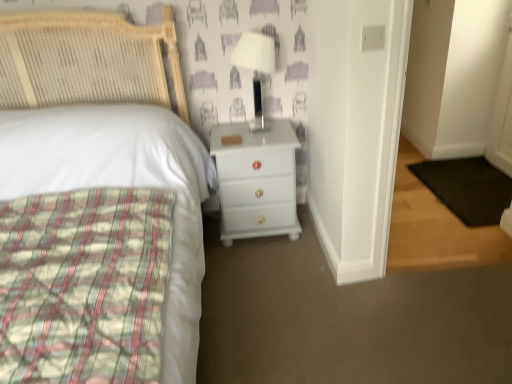
Question: Is white glossy lamp at upper right aimed at white glossy chest of drawers at center?

Choices:
 (A) yes
 (B) no

Answer: (B)

Question: From a real-world perspective, is white glossy lamp at upper right below white glossy chest of drawers at center?

Choices:
 (A) yes
 (B) no

Answer: (B)

Question: Can you confirm if white glossy lamp at upper right is taller than white glossy chest of drawers at center?

Choices:
 (A) yes
 (B) no

Answer: (B)

Question: Considering the relative sizes of white glossy lamp at upper right and white glossy chest of drawers at center in the image provided, is white glossy lamp at upper right smaller than white glossy chest of drawers at center?

Choices:
 (A) no
 (B) yes

Answer: (B)

Question: Is white glossy lamp at upper right shorter than white glossy chest of drawers at center?

Choices:
 (A) yes
 (B) no

Answer: (A)

Question: Is white glossy lamp at upper right to the right of white glossy chest of drawers at center from the viewer's perspective?

Choices:
 (A) yes
 (B) no

Answer: (B)

Question: From a real-world perspective, is white woven headboard at upper left located beneath white glossy lamp at upper right?

Choices:
 (A) yes
 (B) no

Answer: (A)

Question: Can you confirm if white woven headboard at upper left is bigger than white glossy lamp at upper right?

Choices:
 (A) no
 (B) yes

Answer: (B)

Question: Can white glossy lamp at upper right be found inside white woven headboard at upper left?

Choices:
 (A) yes
 (B) no

Answer: (B)

Question: Considering the relative sizes of white woven headboard at upper left and white glossy lamp at upper right in the image provided, is white woven headboard at upper left thinner than white glossy lamp at upper right?

Choices:
 (A) yes
 (B) no

Answer: (B)

Question: Is white woven headboard at upper left placed right next to white glossy lamp at upper right?

Choices:
 (A) yes
 (B) no

Answer: (B)

Question: Is there a large distance between white woven headboard at upper left and white glossy lamp at upper right?

Choices:
 (A) no
 (B) yes

Answer: (A)

Question: Is white glossy chest of drawers at center wider than white glossy lamp at upper right?

Choices:
 (A) no
 (B) yes

Answer: (B)